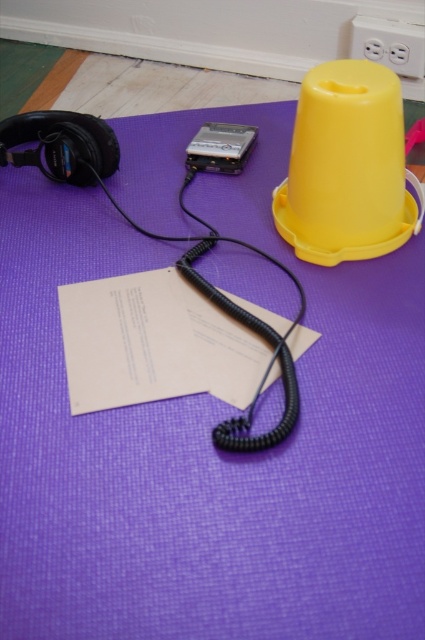
What is the location of the point with coordinates [153,342] in the image?

The point with coordinates [153,342] is located on the white paper at center.

You are organizing items on a purple mat. You need to place a new item between the yellow plastic cone at upper right and the satin black ipod at center. Based on their current positions, where should you place the new item?

The yellow plastic cone at upper right is to the right of the satin black ipod at center, so place the new item between them by positioning it to the left of the yellow plastic cone at upper right and to the right of the satin black ipod at center.